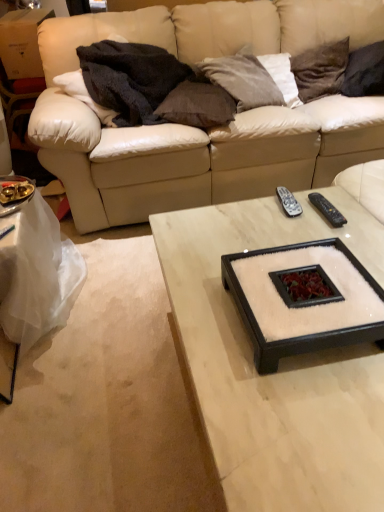
The height and width of the screenshot is (512, 384). I want to click on unoccupied region to the right of white marble coffee table at lower left, the 1th coffee table viewed from the left, so click(121, 295).